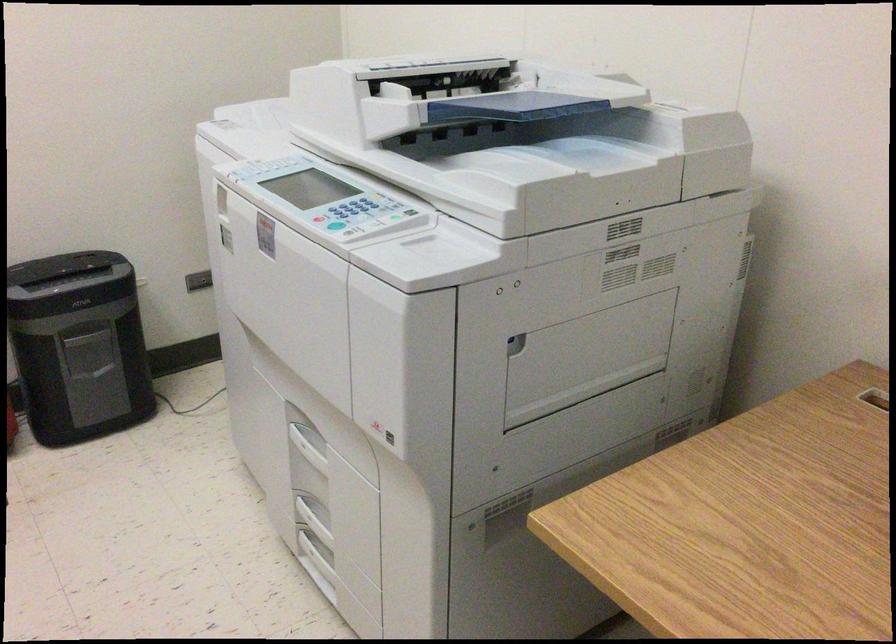
Where is `printer control buttons`? The height and width of the screenshot is (644, 896). printer control buttons is located at coordinates (343, 214).